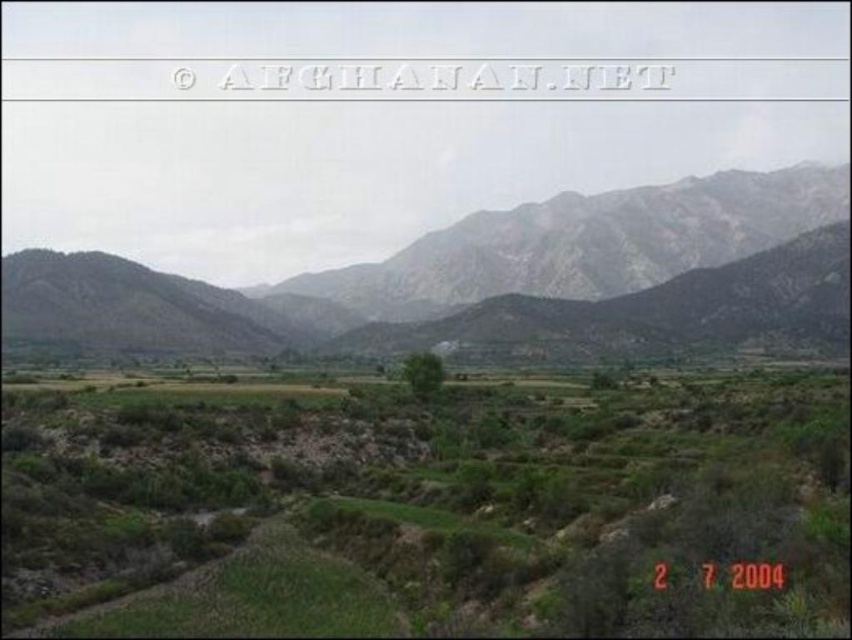
Between green grassy field at center and rocky gray mountain range at upper center, which one appears on the right side from the viewer's perspective?

Positioned to the right is rocky gray mountain range at upper center.

Is green grassy field at center closer to camera compared to rocky gray mountain range at upper center?

Yes, it is.

Image resolution: width=852 pixels, height=640 pixels. I want to click on green grassy field at center, so click(x=429, y=508).